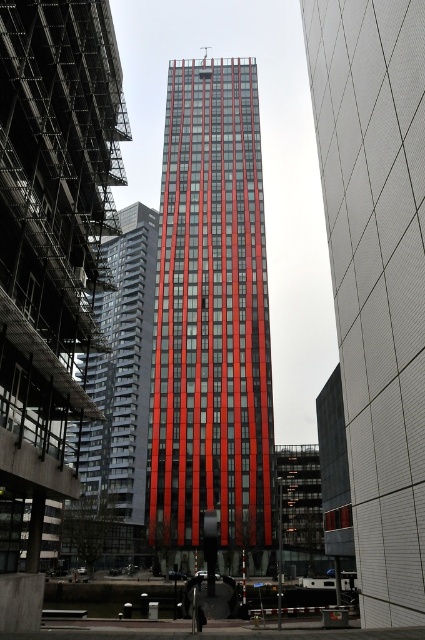
Question: Can you confirm if red glass skyscraper at center is bigger than red glass building at center?

Choices:
 (A) yes
 (B) no

Answer: (A)

Question: Is red glass skyscraper at center closer to the viewer compared to red glass building at center?

Choices:
 (A) no
 (B) yes

Answer: (A)

Question: Which object is positioned farthest from the red glass skyscraper at center?

Choices:
 (A) red glass tower at center
 (B) red glass building at center

Answer: (A)

Question: Which point is farther to the camera?

Choices:
 (A) red glass skyscraper at center
 (B) red glass building at center

Answer: (A)

Question: Which object is positioned closest to the red glass tower at center?

Choices:
 (A) red glass skyscraper at center
 (B) red glass building at center

Answer: (A)

Question: Can you confirm if red glass skyscraper at center is positioned to the left of red glass building at center?

Choices:
 (A) yes
 (B) no

Answer: (A)